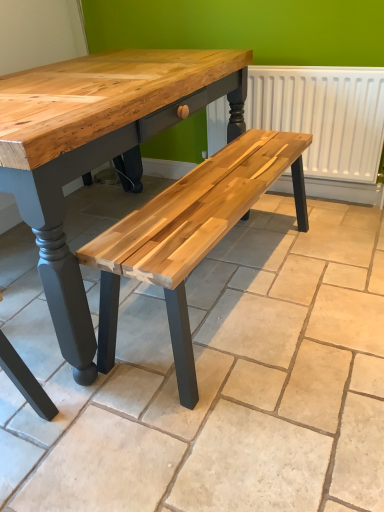
Question: Is white matte radiator at upper right situated inside natural wood bench at center or outside?

Choices:
 (A) inside
 (B) outside

Answer: (B)

Question: Considering the relative positions of white matte radiator at upper right and natural wood bench at center in the image provided, is white matte radiator at upper right to the left or to the right of natural wood bench at center?

Choices:
 (A) left
 (B) right

Answer: (B)

Question: Does point (332, 133) appear closer or farther from the camera than point (354, 492)?

Choices:
 (A) closer
 (B) farther

Answer: (B)

Question: Looking at the image, does natural wood bench at center seem bigger or smaller compared to white matte radiator at upper right?

Choices:
 (A) small
 (B) big

Answer: (B)

Question: In terms of height, does natural wood bench at center look taller or shorter compared to white matte radiator at upper right?

Choices:
 (A) short
 (B) tall

Answer: (A)

Question: From the image's perspective, is natural wood bench at center located above or below white matte radiator at upper right?

Choices:
 (A) above
 (B) below

Answer: (B)

Question: Is point (54, 386) closer or farther from the camera than point (256, 98)?

Choices:
 (A) farther
 (B) closer

Answer: (B)